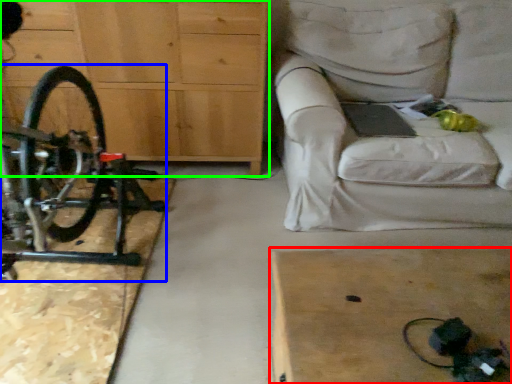
Question: Which is farther away from table (highlighted by a red box)? bicycle (highlighted by a blue box) or chest of drawers (highlighted by a green box)?

Choices:
 (A) bicycle
 (B) chest of drawers

Answer: (B)